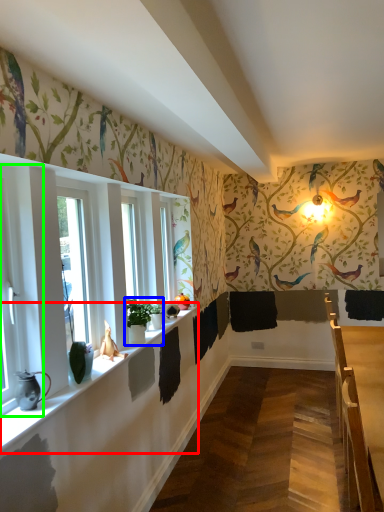
Question: Which object is the farthest from window sill (highlighted by a red box)? Choose among these: houseplant (highlighted by a blue box) or window (highlighted by a green box).

Choices:
 (A) houseplant
 (B) window

Answer: (B)